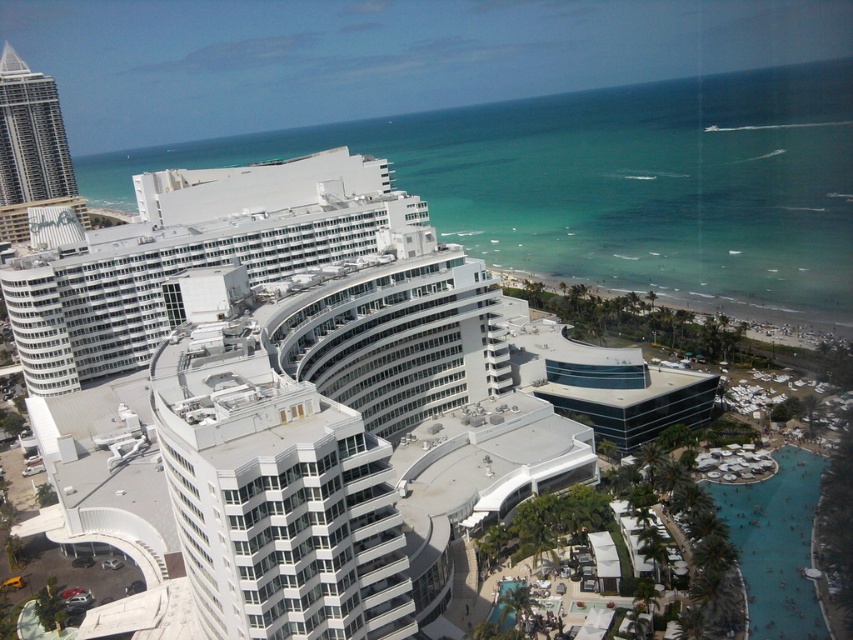
You are a landscape architect designing a new garden between the white glass building at center and the matte white skyscraper at left. Which building should you place the garden closer to if you want it to be near the wider structure?

The white glass building at center is wider than the matte white skyscraper at left, so you should place the garden closer to the white glass building at center.

In the scene shown: You are standing at the point marked by the coordinates point (306,401) in the coastal scene. What is the name of the building you are currently at?

The point (306,401) corresponds to the white glass building at center, so you are at the white glass building at center.